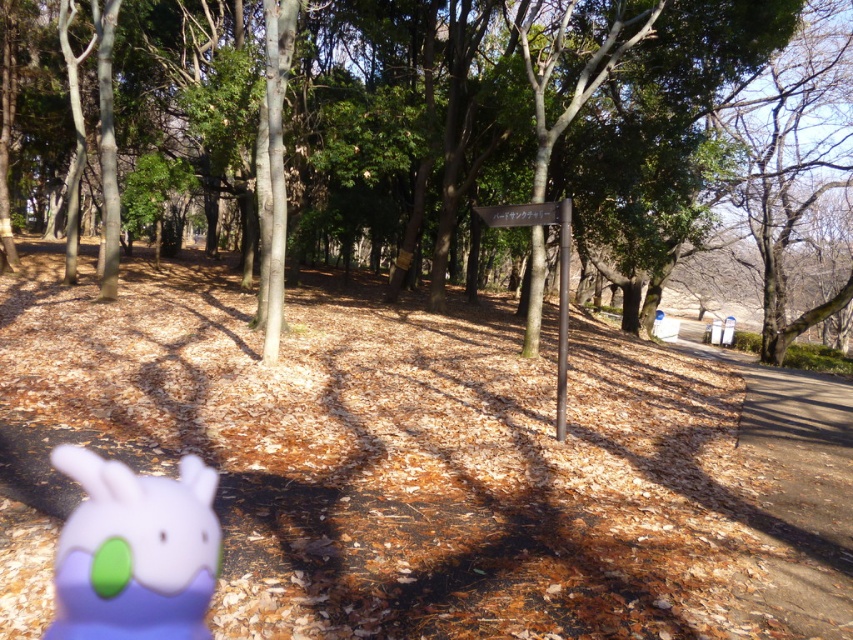
You are standing in a forest and see two points marked in the scene. The first point is at coordinate (115, 372) and the second is at (480, 209). Which point is closer to you?

Point (115, 372) is closer to you because it is further to the viewer than point (480, 209).

You are a hiker who has just spotted the brown dry leaves at center and the purple matte plush toy at lower left in the forest. Which object is closer to you?

The brown dry leaves at center are closer to you because they are further to the viewer than the purple matte plush toy at lower left.

You are standing in the forest scene described. There is an object labeled as brown dry leaves at center. Can you tell me the exact coordinates of this object?

The brown dry leaves at center are located at coordinates point [421,460].